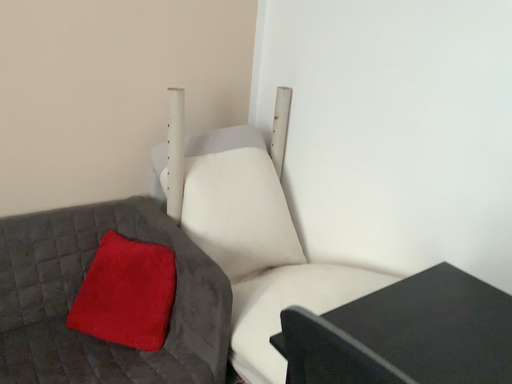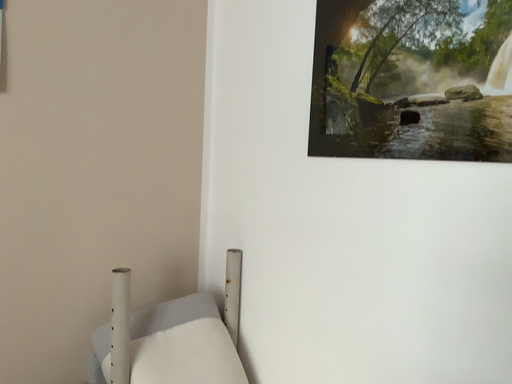
Question: Which way did the camera rotate in the video?

Choices:
 (A) rotated upward
 (B) rotated downward

Answer: (A)